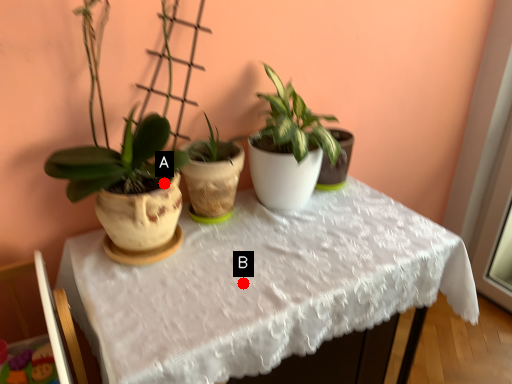
Question: Two points are circled on the image, labeled by A and B beside each circle. Among these points, which one is nearest to the camera?

Choices:
 (A) A is closer
 (B) B is closer

Answer: (B)